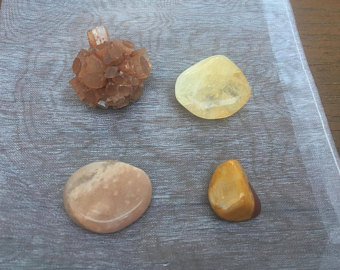
The image size is (340, 270). Identify the location of sheer fabric. (34, 118).